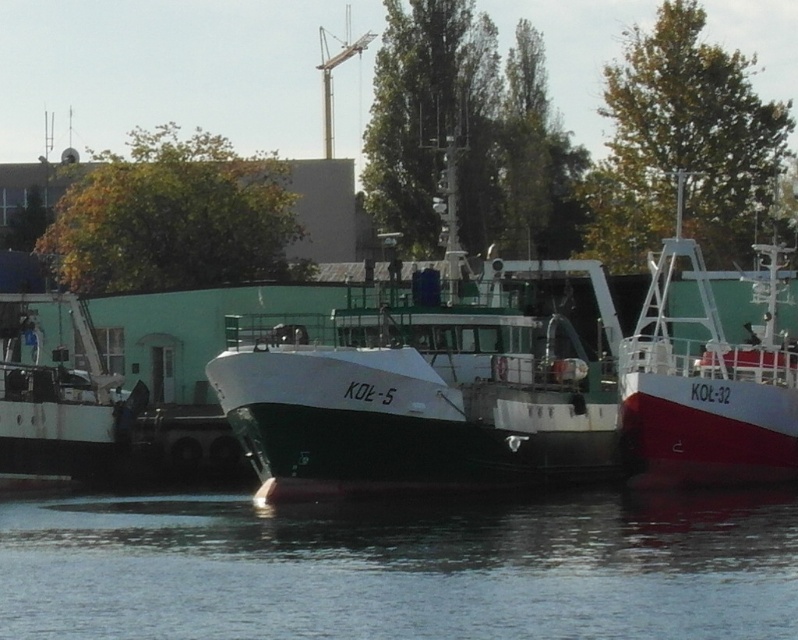
Who is more distant from viewer, (x=18, y=544) or (x=409, y=326)?

The point (x=409, y=326) is more distant.

The height and width of the screenshot is (640, 798). In order to click on transparent water at center in this screenshot , I will do `click(399, 568)`.

Locate an element on the screen. Image resolution: width=798 pixels, height=640 pixels. transparent water at center is located at coordinates coord(399,568).

Between green matte boat at center and red glossy boat at center, which one appears on the left side from the viewer's perspective?

From the viewer's perspective, green matte boat at center appears more on the left side.

Is green matte boat at center to the left of red glossy boat at center from the viewer's perspective?

Indeed, green matte boat at center is positioned on the left side of red glossy boat at center.

This screenshot has width=798, height=640. Describe the element at coordinates (425, 385) in the screenshot. I see `green matte boat at center` at that location.

The image size is (798, 640). I want to click on green matte boat at center, so click(x=425, y=385).

Is point (279, 576) positioned behind point (760, 461)?

No, (279, 576) is in front of (760, 461).

Who is positioned more to the right, transparent water at center or red glossy boat at center?

red glossy boat at center is more to the right.

Identify the location of transparent water at center. (399, 568).

Image resolution: width=798 pixels, height=640 pixels. Find the location of `transparent water at center`. transparent water at center is located at coordinates (399, 568).